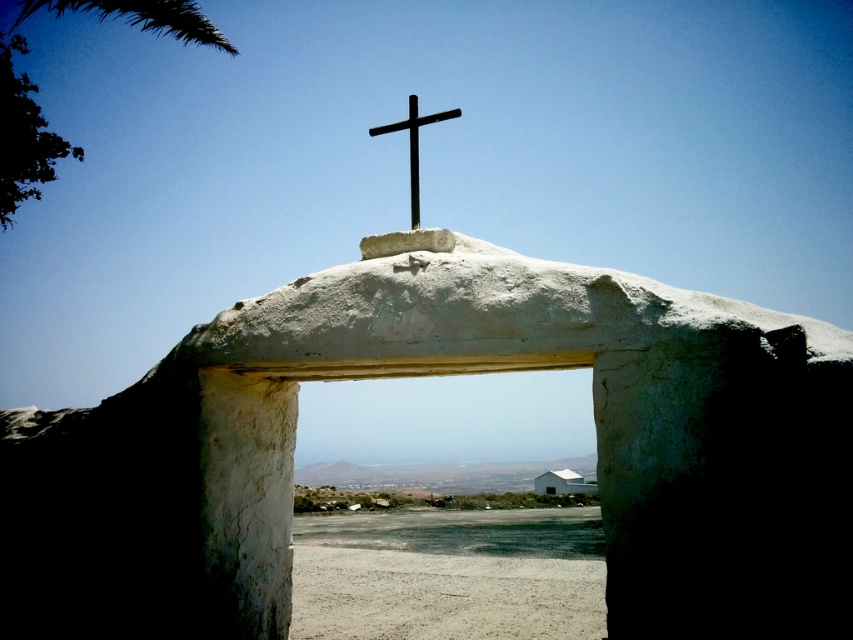
Question: Considering the relative positions of green leafy palm tree at upper left and black metal cross at center in the image provided, where is green leafy palm tree at upper left located with respect to black metal cross at center?

Choices:
 (A) below
 (B) above

Answer: (B)

Question: Can you confirm if green leafy palm tree at upper left is positioned to the right of black metal cross at center?

Choices:
 (A) yes
 (B) no

Answer: (B)

Question: Which of the following is the farthest from the observer?

Choices:
 (A) green leafy palm tree at upper left
 (B) black metal cross at center

Answer: (A)

Question: Is green leafy palm tree at upper left closer to camera compared to black metal cross at center?

Choices:
 (A) no
 (B) yes

Answer: (A)